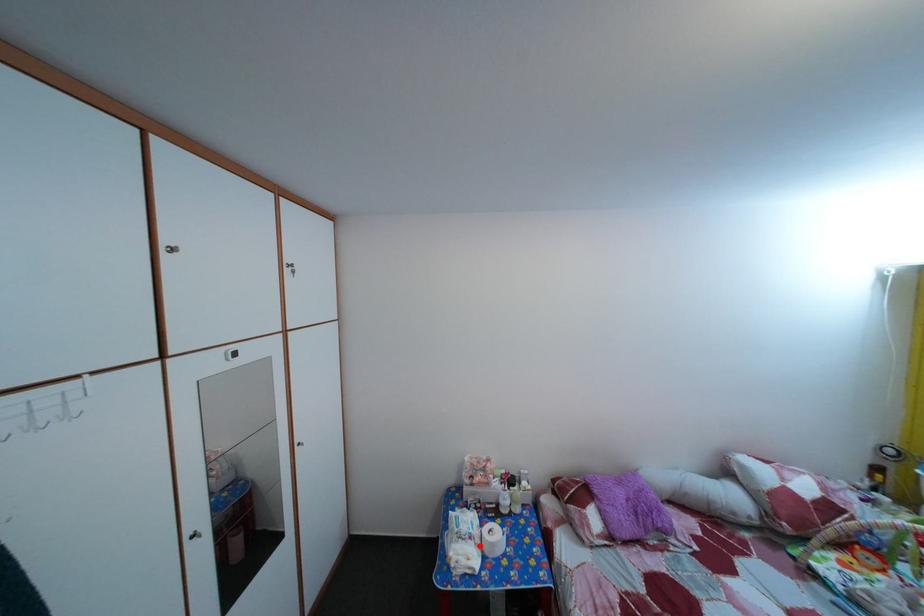
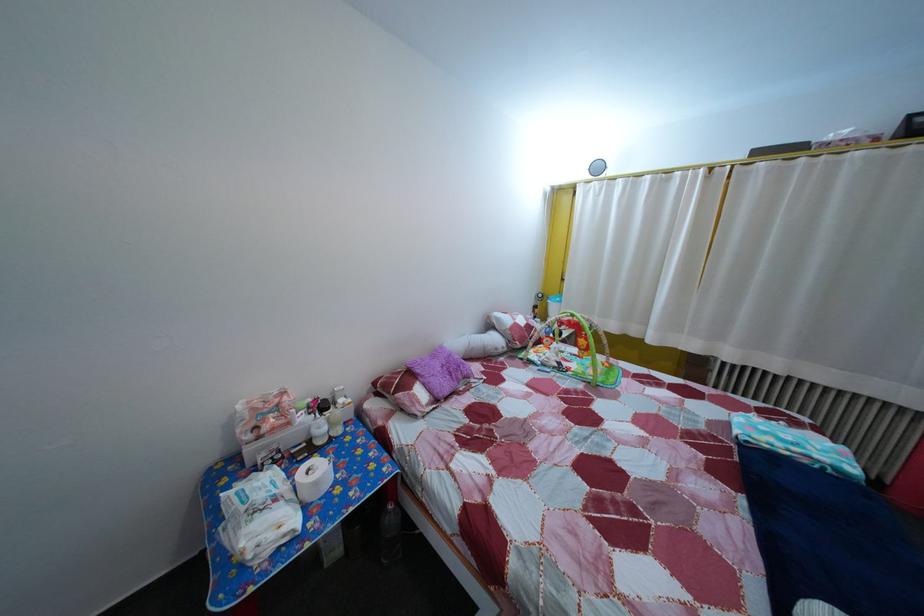
Where in the second image is the point corresponding to the highlighted location from the first image?

(285, 508)